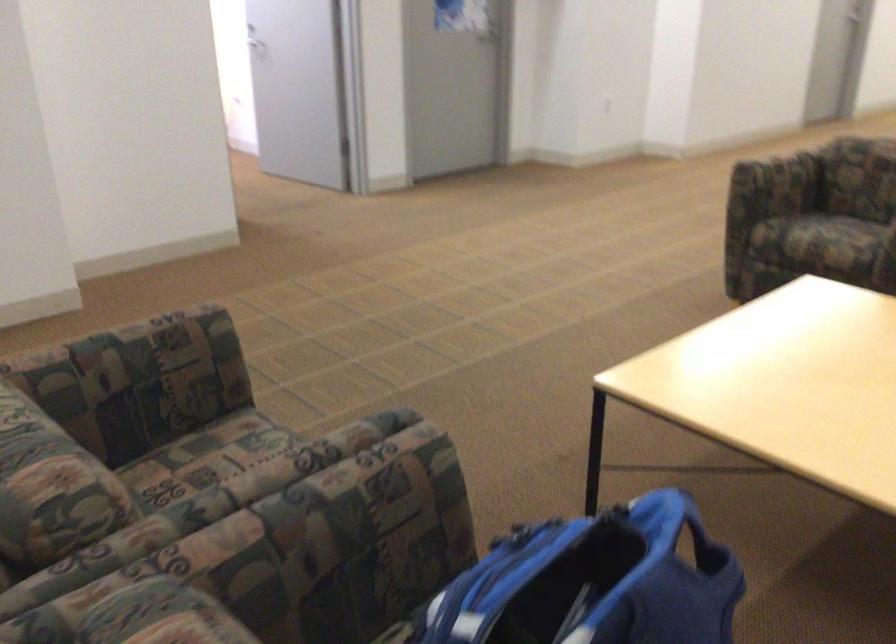
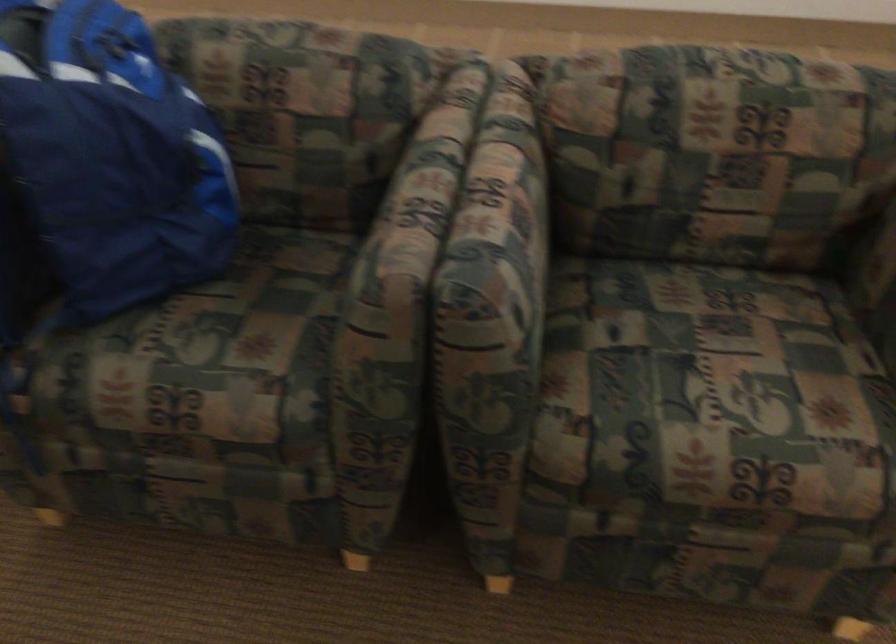
The point at (x=366, y=460) is marked in the first image. Where is the corresponding point in the second image?

(412, 207)